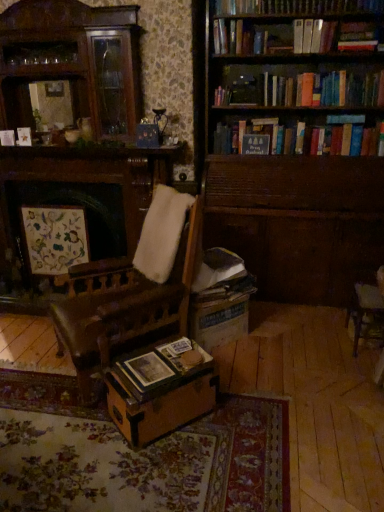
What are the coordinates of `vacant area on top of wooden photo album at center, marked as the 3th book in a back-to-front arrangement (from a real-world perspective)` in the screenshot? It's located at (154, 368).